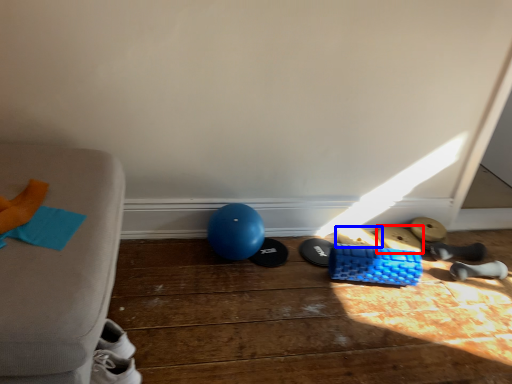
Question: Which object is closer to the camera taking this photo, footwear (highlighted by a red box) or footwear (highlighted by a blue box)?

Choices:
 (A) footwear
 (B) footwear

Answer: (B)